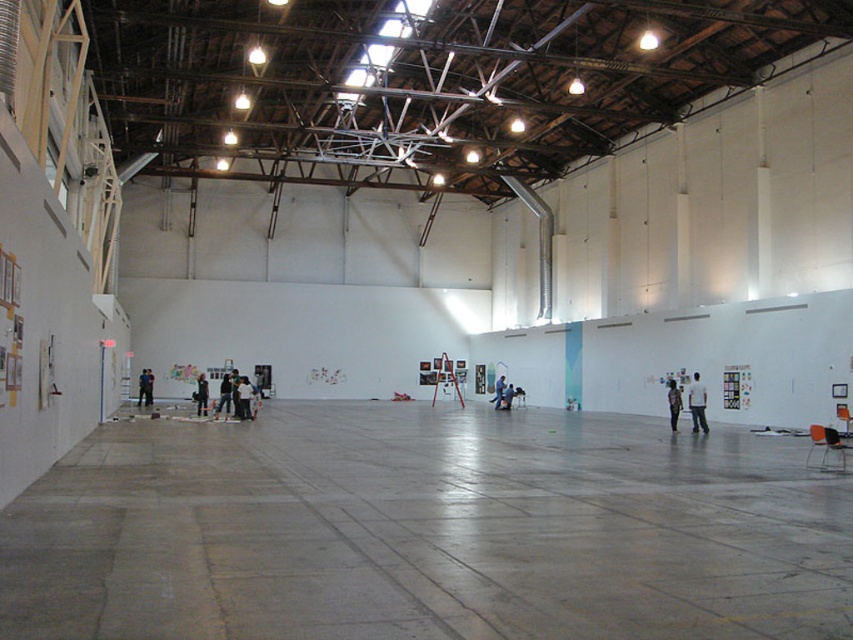
Looking at this image, you are standing in the industrial gallery and notice a person wearing a dark gray shirt at center and blue jeans at center. Which part of their clothing is closer to you?

The dark gray shirt at center is closer to the viewer than the blue jeans at center.

In the scene shown: You are standing in the industrial gallery and want to move from the point at coordinates (x=244, y=408) to the point at (x=148, y=404). Based on their positions, which direction should you move to reach your destination?

Since point (x=244, y=408) is in front of point (x=148, y=404), you should move backward to reach the destination.

You are an art critic standing at the entrance of the gallery. You notice two figures at the center of the room, the dark gray shirt at center and the black matte person at center. Which figure would appear larger to you from your current position?

The dark gray shirt at center would appear larger because it is closer to the viewer than the black matte person at center.